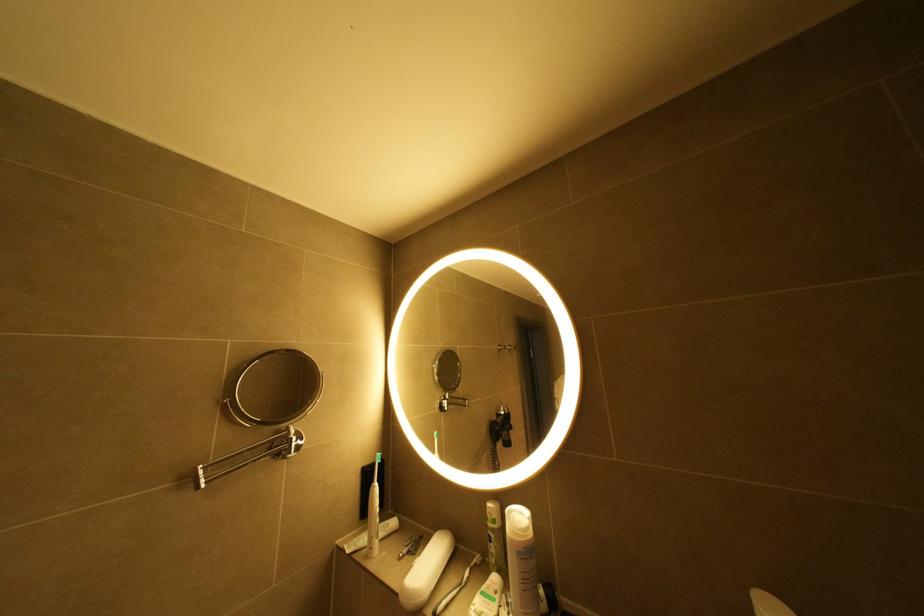
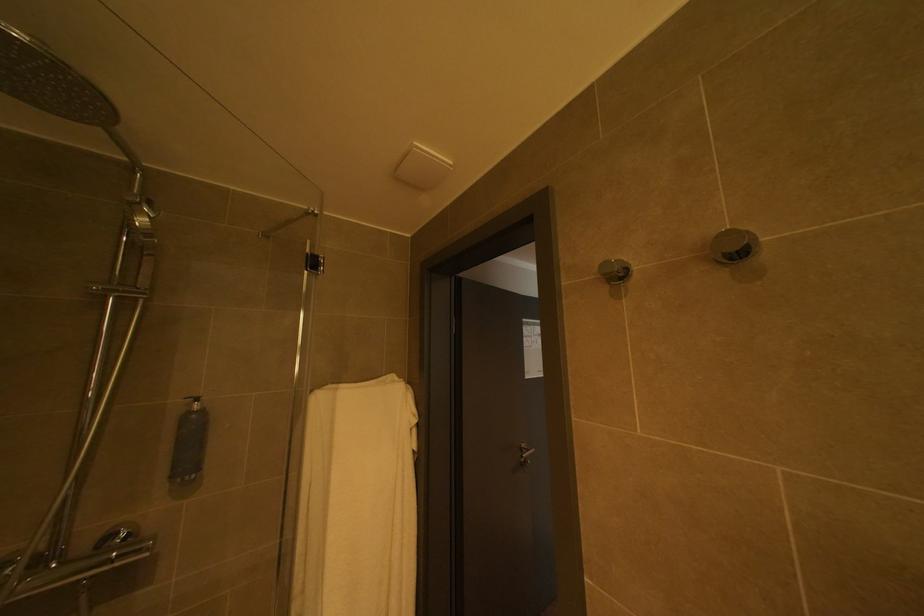
Question: The camera is either moving clockwise (left) or counter-clockwise (right) around the object. The first image is from the beginning of the video and the second image is from the end. Is the camera moving left or right when shooting the video?

Choices:
 (A) Left
 (B) Right

Answer: (B)